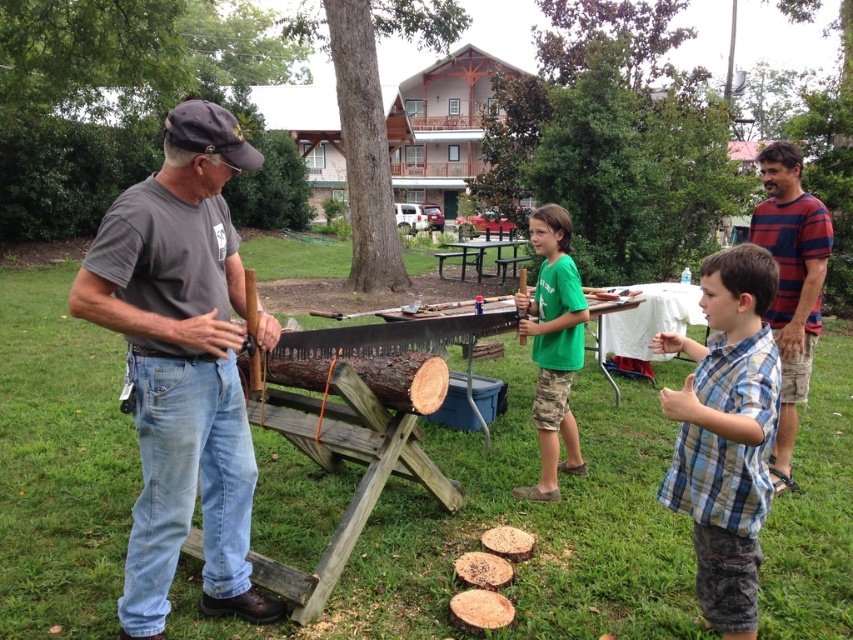
Based on the photo, you are standing in the outdoor woodworking area and want to greet both the person in the blue striped shirt at upper right and the person in the green cotton shirt at center. Which person should you approach first to be polite?

You should approach the person in the blue striped shirt at upper right first because they are closer to you than the green cotton shirt at center, so it would be more polite to greet them first.

Which person is positioned to the right of the other between the blue striped shirt at upper right and the green cotton shirt at center?

The blue striped shirt at upper right is positioned to the right of the green cotton shirt at center.

You are a photographer standing at the edge of the grassy area. You want to take a photo that includes both the blue plaid shirt at center and the blue striped shirt at upper right. Which person should be closer to the camera to ensure both are in focus?

The blue plaid shirt at center is in front of the blue striped shirt at upper right, so the blue plaid shirt at center should be closer to the camera to ensure both are in focus.